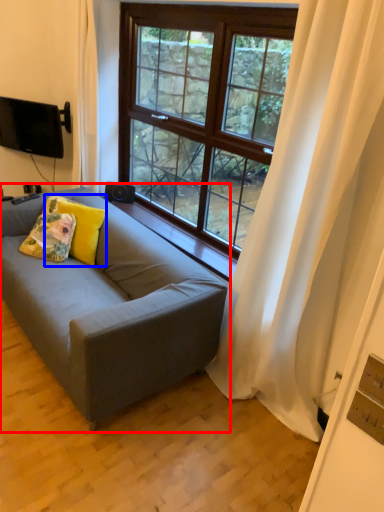
Question: Which object is further to the camera taking this photo, studio couch (highlighted by a red box) or pillow (highlighted by a blue box)?

Choices:
 (A) studio couch
 (B) pillow

Answer: (B)